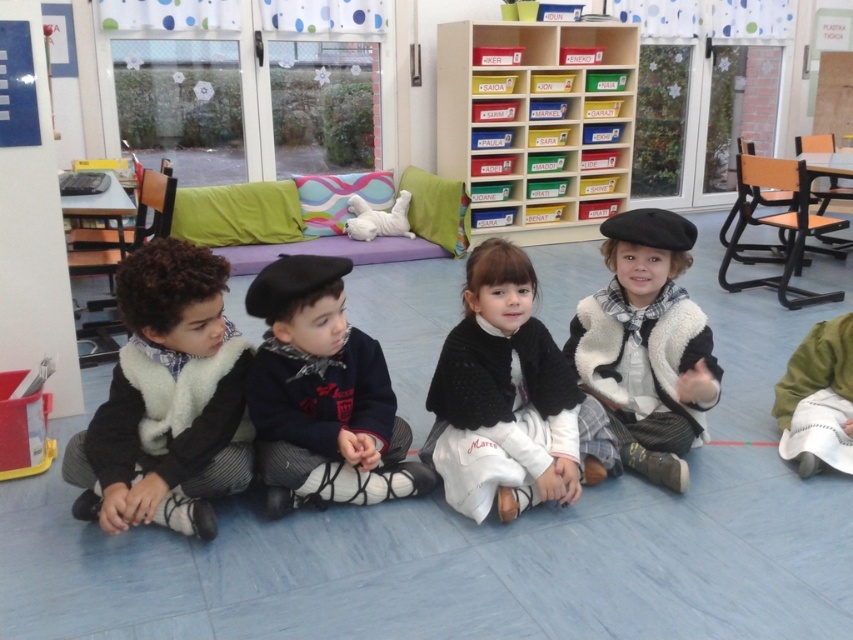
Is velvet black vest at left closer to camera compared to white fuzzy coat at center?

Yes, it is.

Does point (155, 253) lie behind point (479, 394)?

No, it is not.

Find the location of a particular element. The width and height of the screenshot is (853, 640). velvet black vest at left is located at coordinates (167, 400).

Who is positioned more to the left, matte black beret at center or white fuzzy coat at center?

Positioned to the left is matte black beret at center.

From the picture: Who is positioned more to the right, matte black beret at center or white fuzzy coat at center?

white fuzzy coat at center

Measure the distance between matte black beret at center and camera.

matte black beret at center and camera are 1.99 meters apart.

At what (x,y) coordinates should I click in order to perform the action: click on matte black beret at center. Please return your answer as a coordinate pair (x, y). Image resolution: width=853 pixels, height=640 pixels. Looking at the image, I should click on (322, 394).

Between point (253, 396) and point (682, 268), which one is positioned behind?

Positioned behind is point (682, 268).

Does point (399, 493) lie behind point (592, 365)?

That is False.

Find the location of a particular element. matte black beret at center is located at coordinates (322, 394).

Where is `matte black beret at center`? Image resolution: width=853 pixels, height=640 pixels. matte black beret at center is located at coordinates (322, 394).